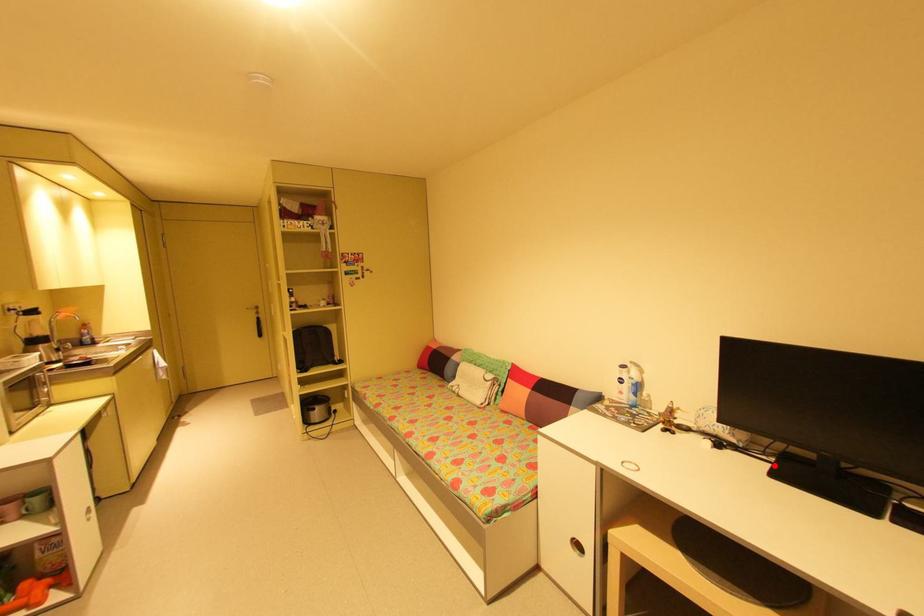
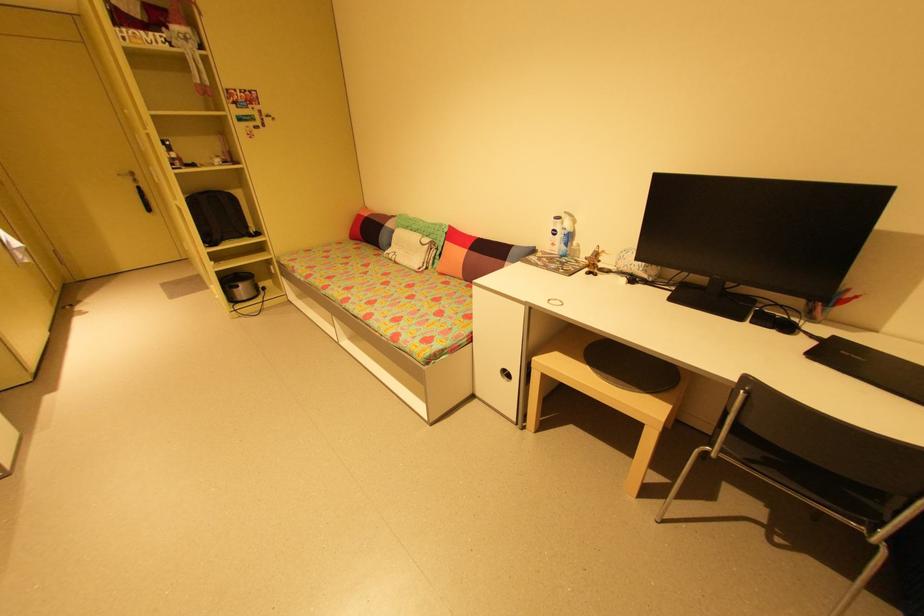
Find the pixel in the second image that matches the highlighted location in the first image.

(675, 293)